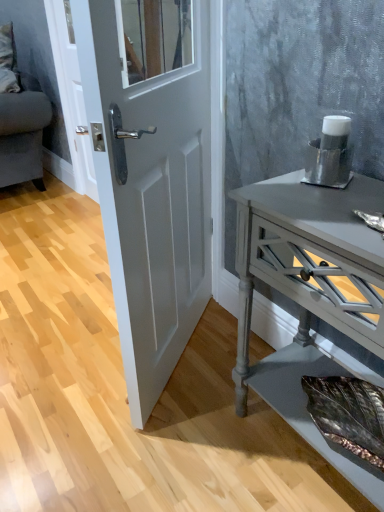
The width and height of the screenshot is (384, 512). Identify the location of vacant area that is situated to the right of white glossy door at center. (211, 350).